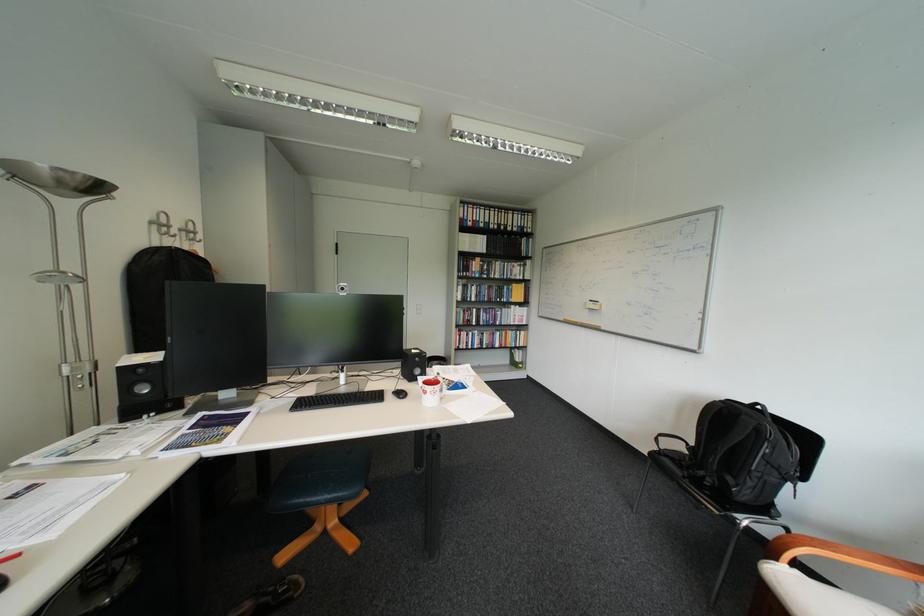
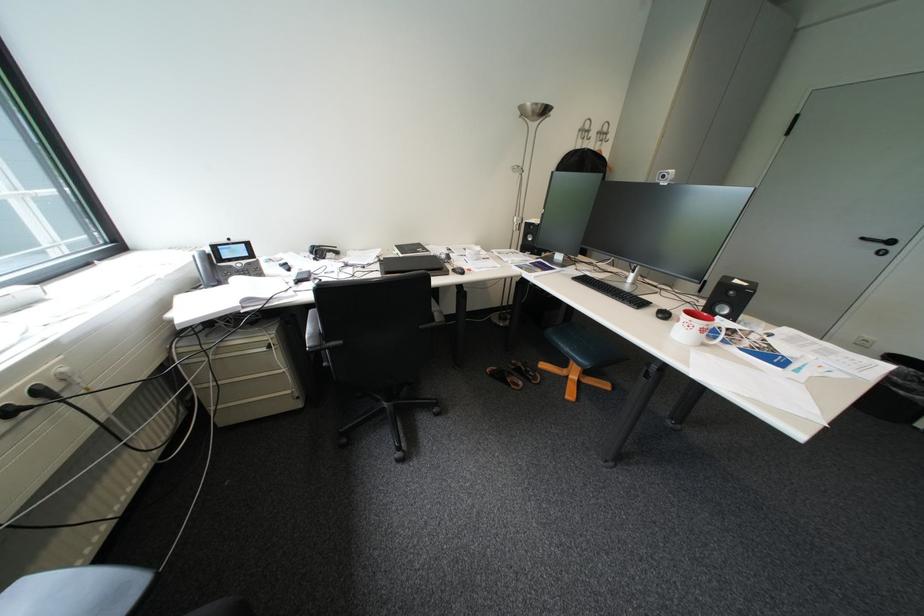
In the second image, find the point that corresponds to (313,501) in the first image.

(569, 341)